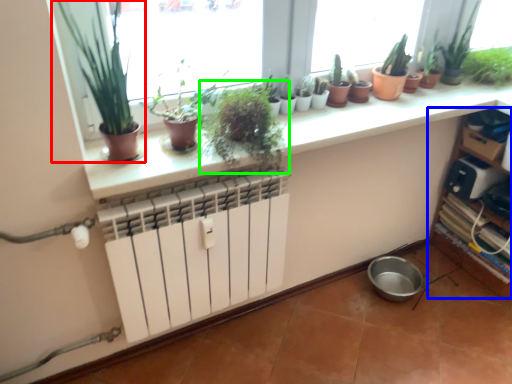
Question: Considering the real-world distances, which object is closest to houseplant (highlighted by a red box)? shelf (highlighted by a blue box) or houseplant (highlighted by a green box).

Choices:
 (A) shelf
 (B) houseplant

Answer: (B)